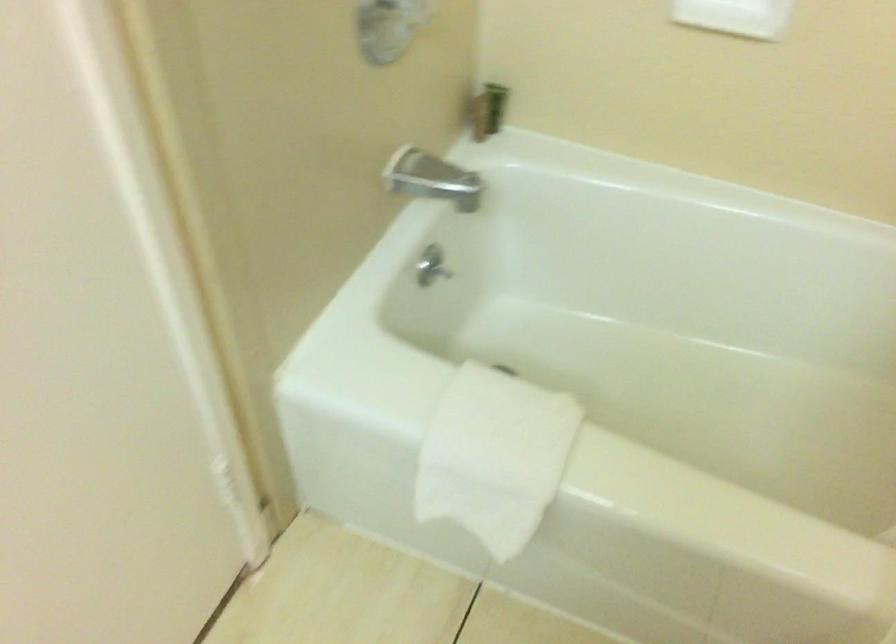
Image resolution: width=896 pixels, height=644 pixels. Describe the element at coordinates (424, 176) in the screenshot. I see `the metal faucet handle` at that location.